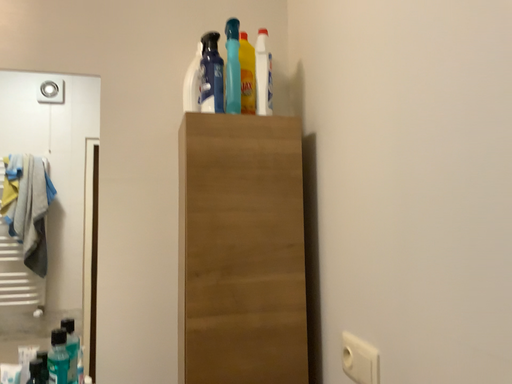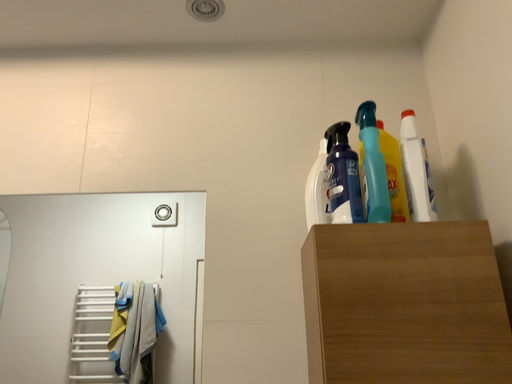
Question: How did the camera likely rotate when shooting the video?

Choices:
 (A) rotated left
 (B) rotated right

Answer: (A)